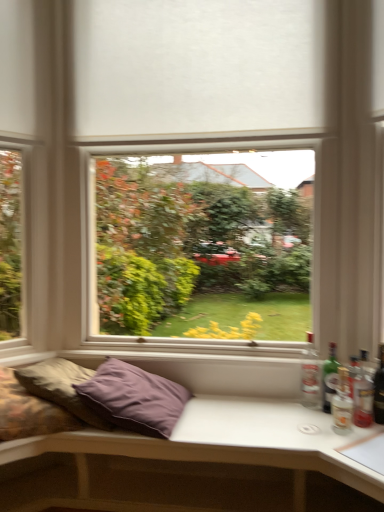
The width and height of the screenshot is (384, 512). Identify the location of vacant area that is in front of green glass bottle at right, the second bottle from the left. (336, 428).